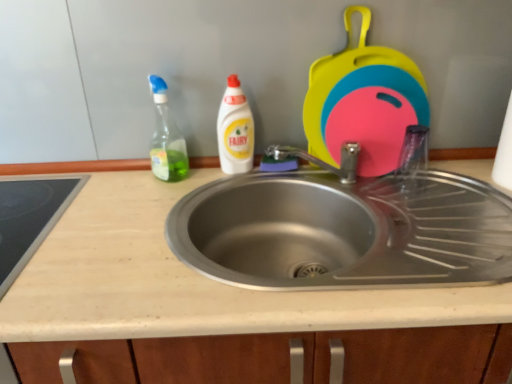
The height and width of the screenshot is (384, 512). In order to click on free space between translucent plastic spray bottle at left, the second cleaning product from the right, and white glossy bottle at center, the 2th cleaning product in the left-to-right sequence in this screenshot , I will do `click(206, 175)`.